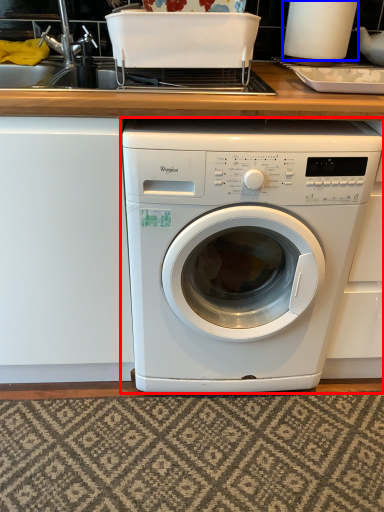
Question: Which point is further to the camera, washing machine (highlighted by a red box) or appliance (highlighted by a blue box)?

Choices:
 (A) washing machine
 (B) appliance

Answer: (B)